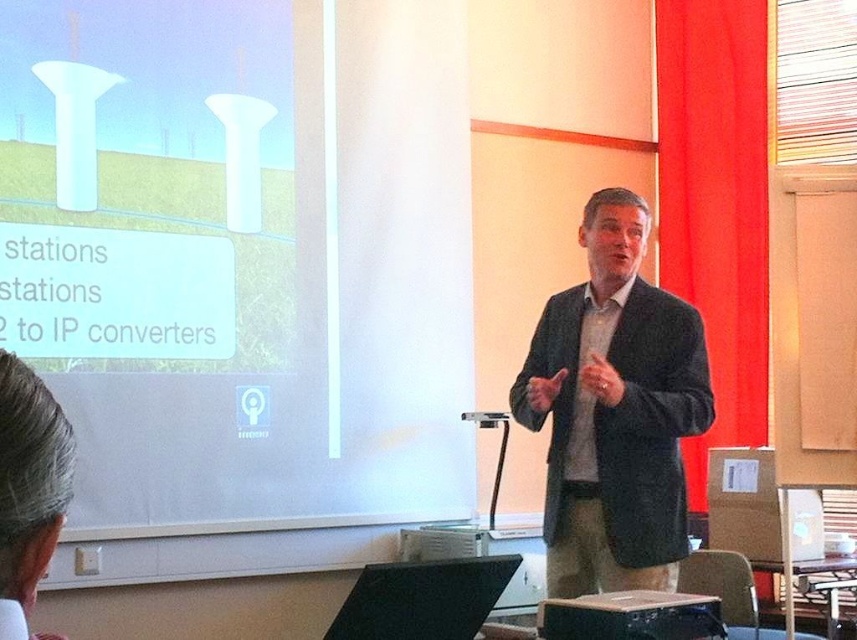
Question: Is white matte projection screen at upper left above dark gray suit at center?

Choices:
 (A) no
 (B) yes

Answer: (B)

Question: Which object is the farthest from the gray hair at lower left?

Choices:
 (A) dark gray suit at center
 (B) white matte projection screen at upper left

Answer: (B)

Question: Which of the following is the closest to the observer?

Choices:
 (A) (49, 19)
 (B) (13, 529)
 (C) (536, 353)

Answer: (B)

Question: Does white matte projection screen at upper left appear on the right side of dark gray suit at center?

Choices:
 (A) no
 (B) yes

Answer: (A)

Question: Does dark gray suit at center appear under gray hair at lower left?

Choices:
 (A) no
 (B) yes

Answer: (A)

Question: Which point appears closest to the camera in this image?

Choices:
 (A) (613, 545)
 (B) (42, 513)

Answer: (B)